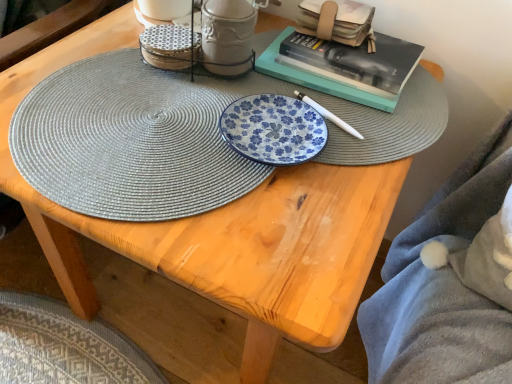
Where is `free space in front of matte ceramic mug at upper center, which is the second tableware in left-to-right order`? free space in front of matte ceramic mug at upper center, which is the second tableware in left-to-right order is located at coordinates (189, 132).